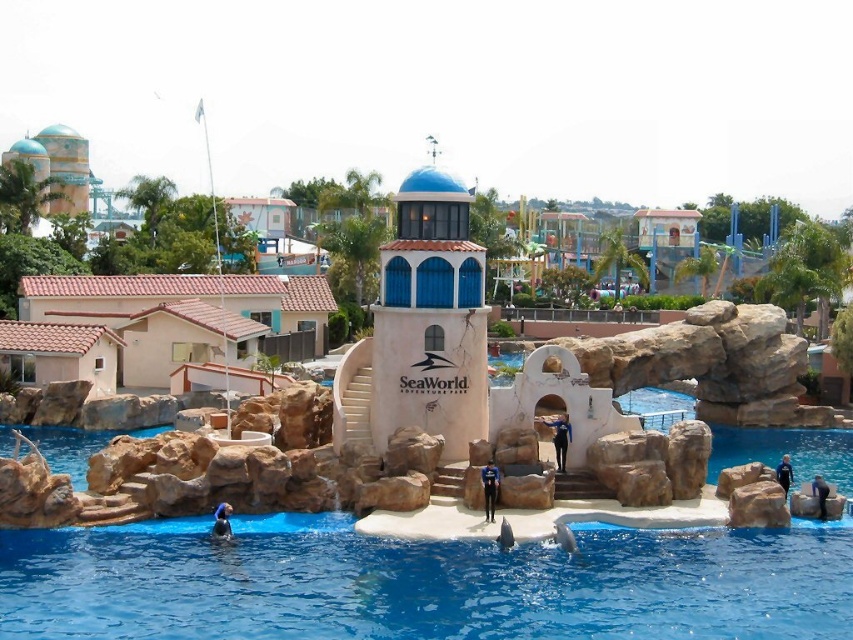
You are planning to take a photo of the blue painted concrete tower at center and the beige tile roof house at left. Which object should you zoom in more on to ensure both are clearly visible in the frame?

Since the blue painted concrete tower at center is narrower than the beige tile roof house at left, you should zoom in more on the beige tile roof house at left to ensure both fit clearly in the frame.

You are a visitor at SeaWorld Adventure Park and want to take a photo of the blue glossy water at lower center and the blue painted concrete tower at center together in the same frame. Your camera has a maximum zoom range that allows capturing objects up to 12 meters apart. Can you fit both objects in the photo without moving your position?

The blue glossy water at lower center and blue painted concrete tower at center are 13.26 meters apart. Since your camera can only capture up to 12 meters, you cannot fit both objects in the photo without moving your position.